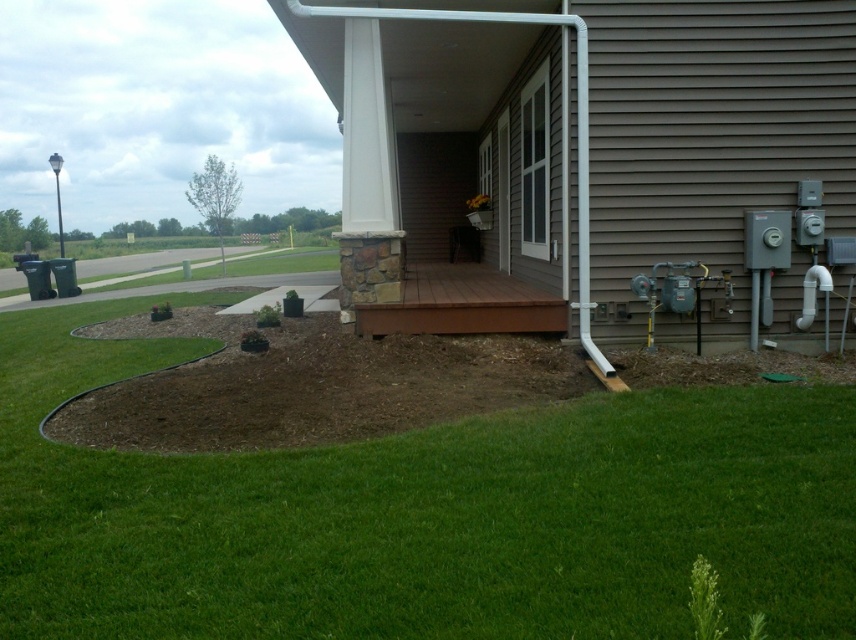
You are a gardener who needs to move a heavy wheelbarrow from the green grass at lower center to the brown wood deck at center. Considering the distance between them, will you be able to push the wheelbarrow directly without needing to go around any obstacles?

The green grass at lower center and brown wood deck at center are 18.35 feet apart from each other. Since there is no mention of obstacles in the scene description, you can push the wheelbarrow directly between them.

You are standing in the residential outdoor scene and want to walk from the green grass at lower center to the brown wood deck at center. Which direction should you move to get closer to the deck?

Since the green grass at lower center is closer to the viewer than the brown wood deck at center, you should move backward to get closer to the deck.